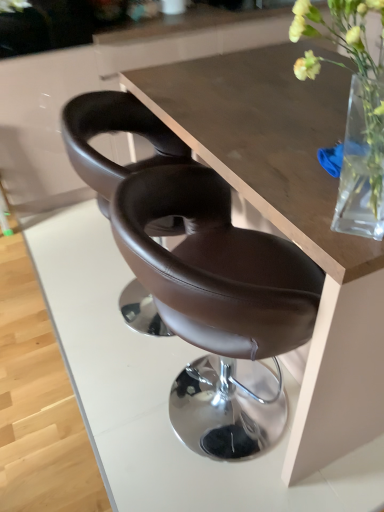
Where is `empty space that is ontop of brown leather chair at center, the second chair viewed from the front`? The width and height of the screenshot is (384, 512). empty space that is ontop of brown leather chair at center, the second chair viewed from the front is located at coordinates (176, 99).